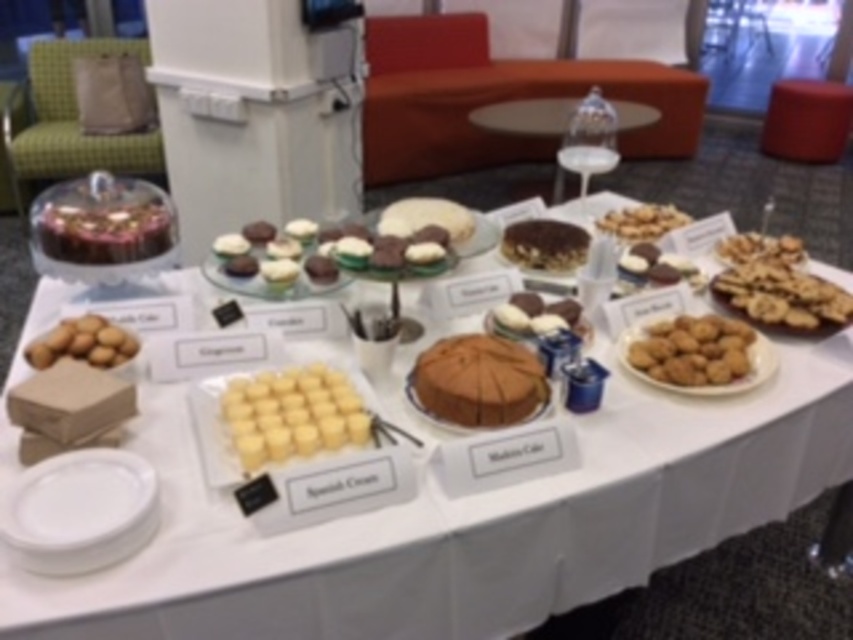
Question: Can you confirm if yellow matte cream puffs at center is wider than crumbly golden cookies at center-right?

Choices:
 (A) yes
 (B) no

Answer: (B)

Question: Which object appears closest to the camera in this image?

Choices:
 (A) crumbly golden cookies at center-right
 (B) white chocolate-covered cookies at center
 (C) golden brown cookie at lower left

Answer: (C)

Question: Can you confirm if yellow matte cream puffs at center is positioned below golden brown cookie at lower left?

Choices:
 (A) no
 (B) yes

Answer: (B)

Question: Does brown matte cake at center lie in front of golden brown cookie at lower left?

Choices:
 (A) no
 (B) yes

Answer: (B)

Question: Which object appears closest to the camera in this image?

Choices:
 (A) white frosted cupcakes at center
 (B) golden brown crumbly cookies at right

Answer: (B)

Question: Which object is positioned farthest from the white frosted cupcakes at center?

Choices:
 (A) brown matte cake at center
 (B) white chocolate-covered cookies at center

Answer: (B)